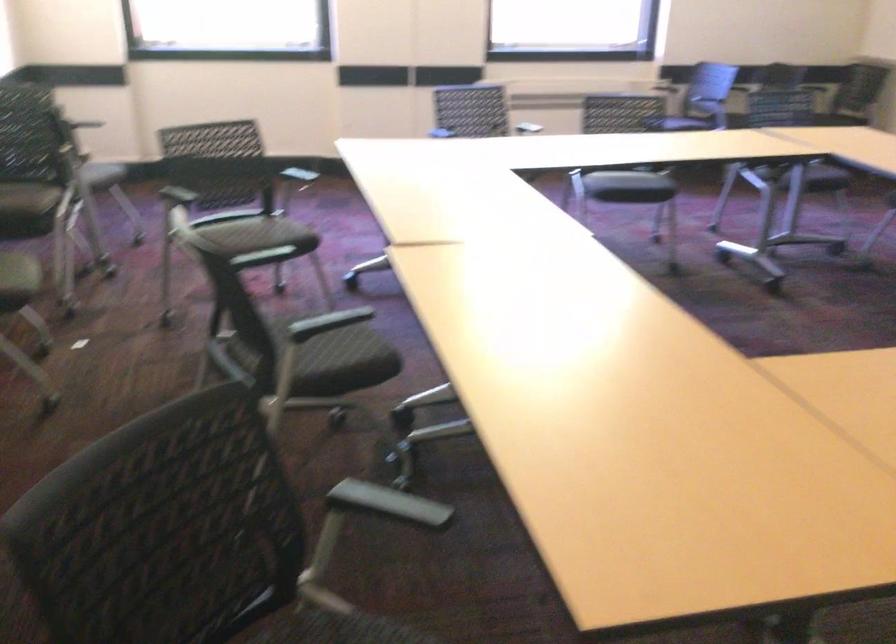
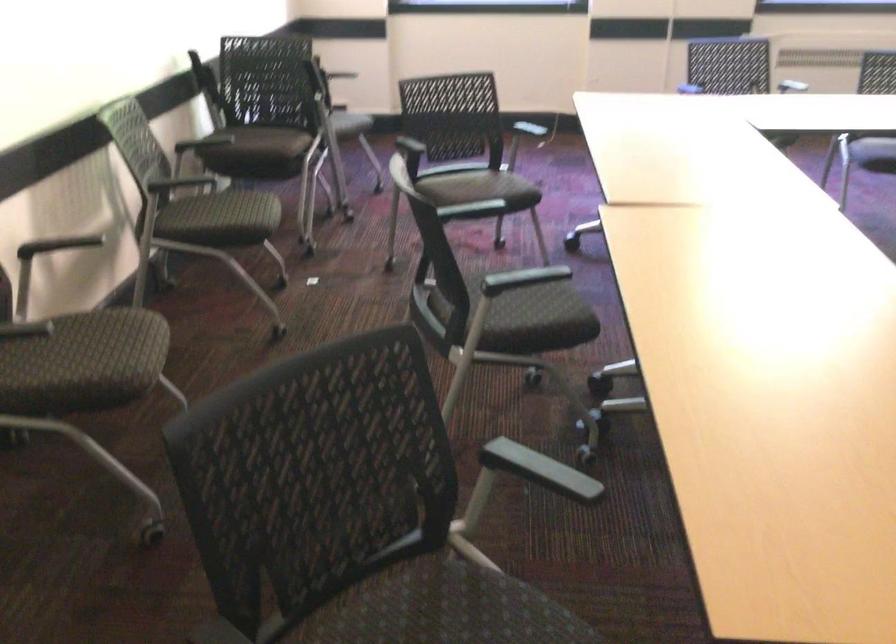
Question: The first image is from the beginning of the video and the second image is from the end. How did the camera likely rotate when shooting the video?

Choices:
 (A) Left
 (B) Right
 (C) Up
 (D) Down

Answer: (A)